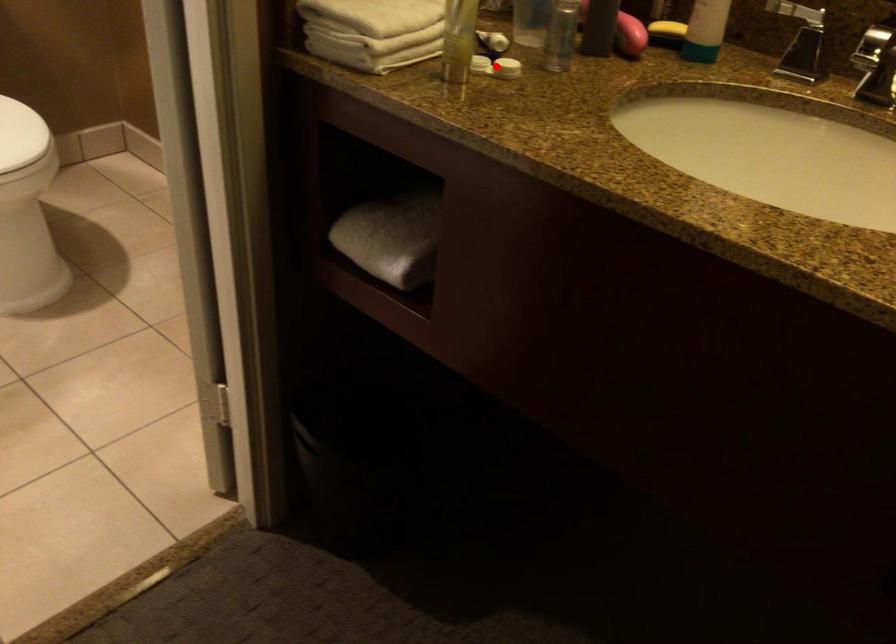
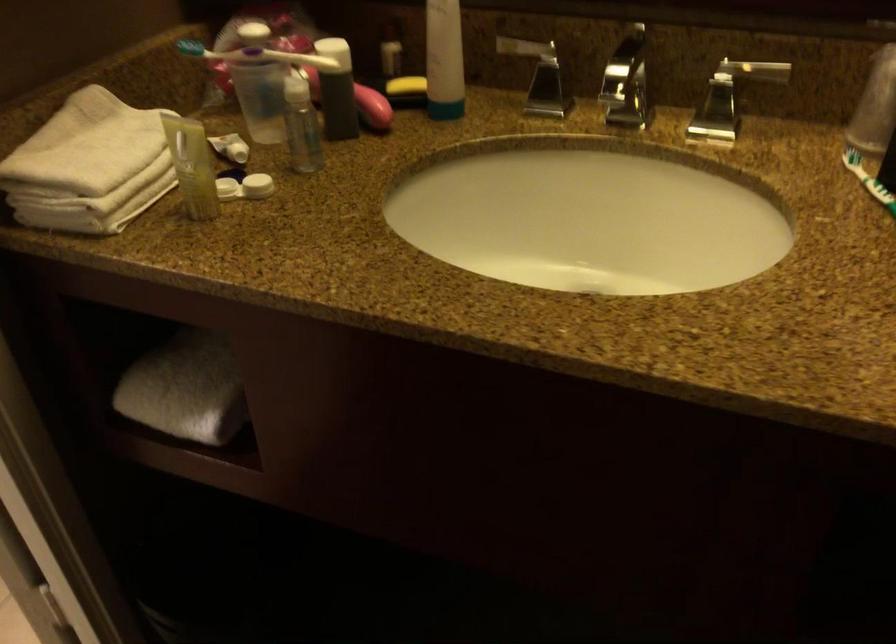
The point at the highlighted location is marked in the first image. Where is the corresponding point in the second image?

(245, 187)